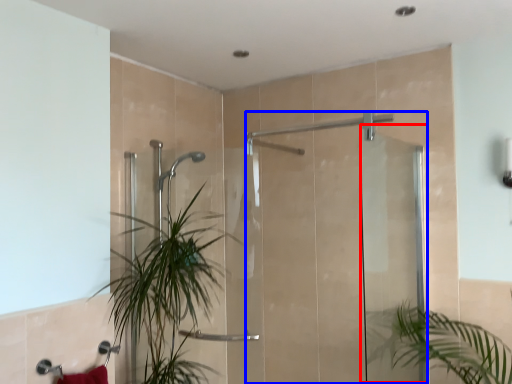
Question: Among these objects, which one is farthest to the camera, screen door (highlighted by a red box) or screen door (highlighted by a blue box)?

Choices:
 (A) screen door
 (B) screen door

Answer: (B)